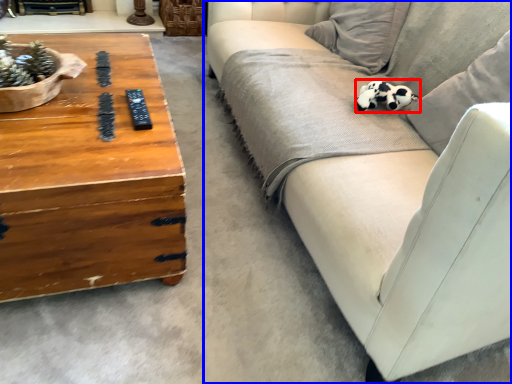
Question: Which object is closer to the camera taking this photo, animal (highlighted by a red box) or studio couch (highlighted by a blue box)?

Choices:
 (A) animal
 (B) studio couch

Answer: (B)